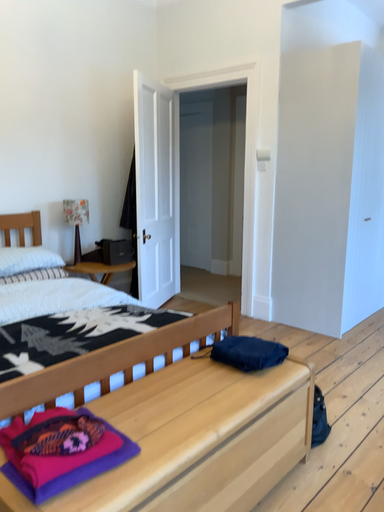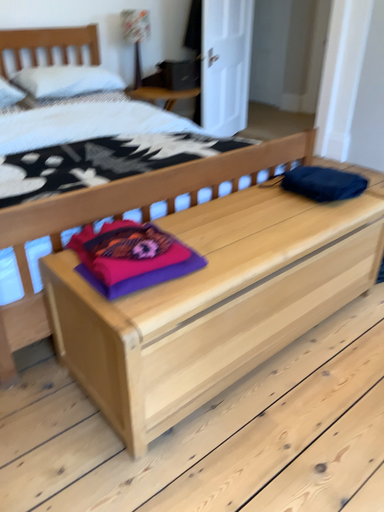
Question: How did the camera likely rotate when shooting the video?

Choices:
 (A) rotated right
 (B) rotated left

Answer: (B)